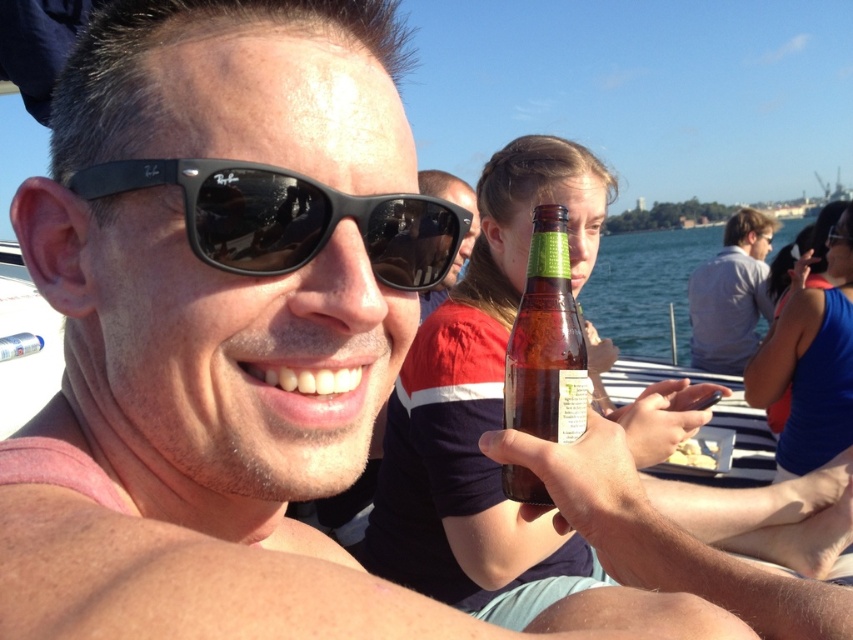
Question: Is clear blue water at center bigger than brown glass bottle at center?

Choices:
 (A) yes
 (B) no

Answer: (A)

Question: Among these objects, which one is farthest from the camera?

Choices:
 (A) matte black sunglasses at center
 (B) black matte sunglasses at center
 (C) white plastic bottle at upper left
 (D) brown glass bottle at center

Answer: (C)

Question: Where is brown glass bottle at center located in relation to white plastic bottle at upper left in the image?

Choices:
 (A) left
 (B) right

Answer: (B)

Question: Which object is closer to the camera taking this photo?

Choices:
 (A) brown glass bottle at center
 (B) black matte sunglasses at center
 (C) clear blue water at center
 (D) matte black sunglasses at center

Answer: (B)

Question: Which object appears farthest from the camera in this image?

Choices:
 (A) gray cotton shirt at upper right
 (B) brown glass bottle at center
 (C) matte black sunglasses at center

Answer: (A)

Question: Does black matte sunglasses at center have a smaller size compared to brown glass bottle at center?

Choices:
 (A) no
 (B) yes

Answer: (A)